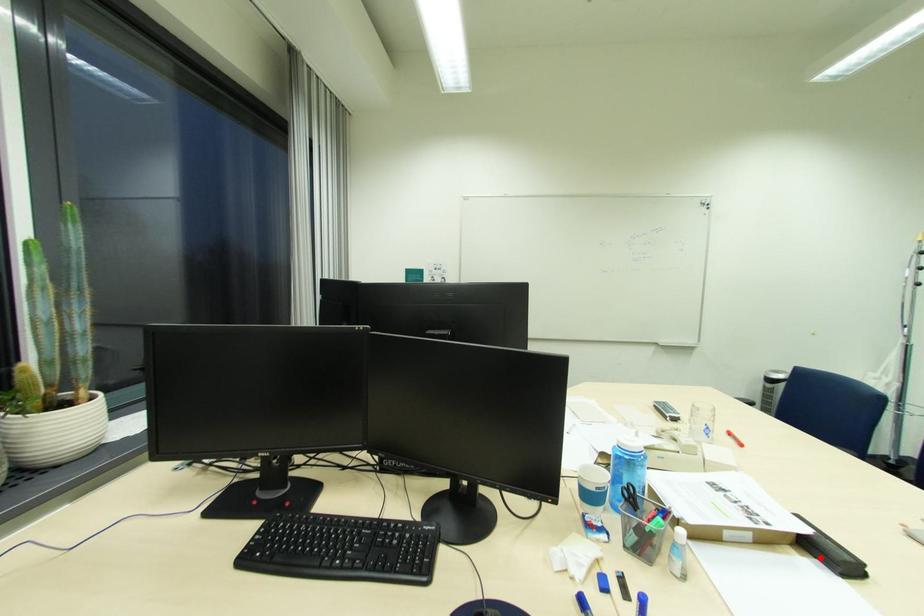
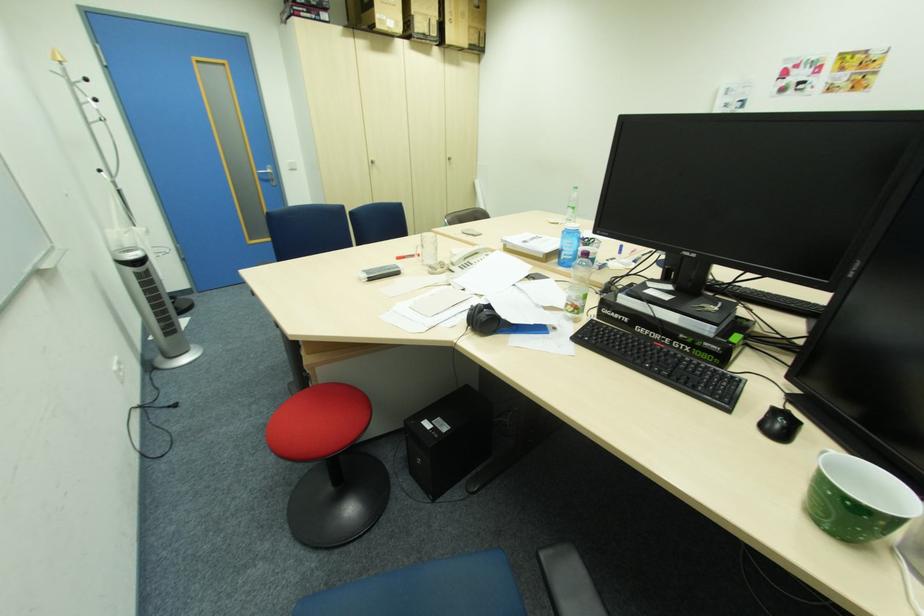
Question: I am providing you with two images of the same scene from different viewpoints. A red point is marked on the first image. At the location where the point appears in image 1, is it still visible in image 2?

Choices:
 (A) Yes
 (B) No

Answer: (B)